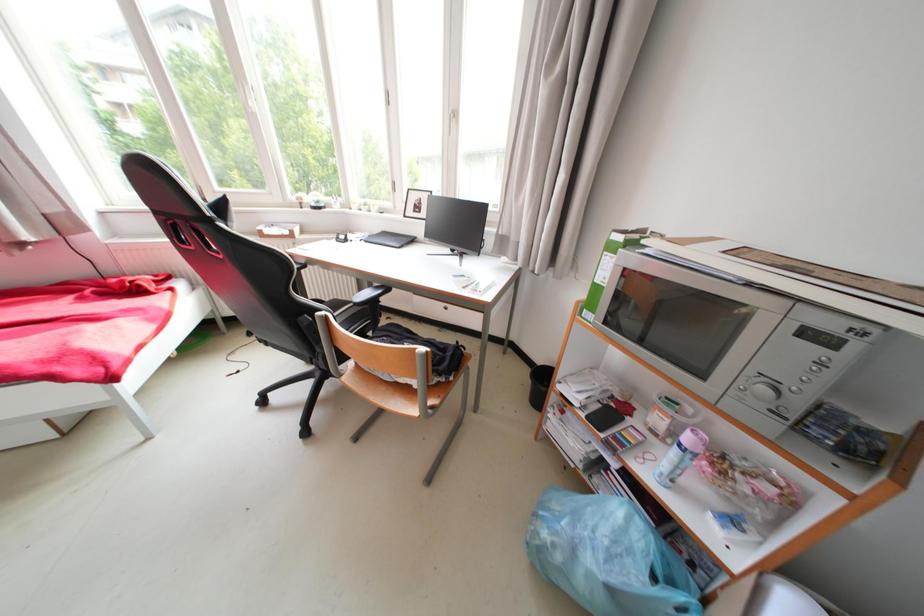
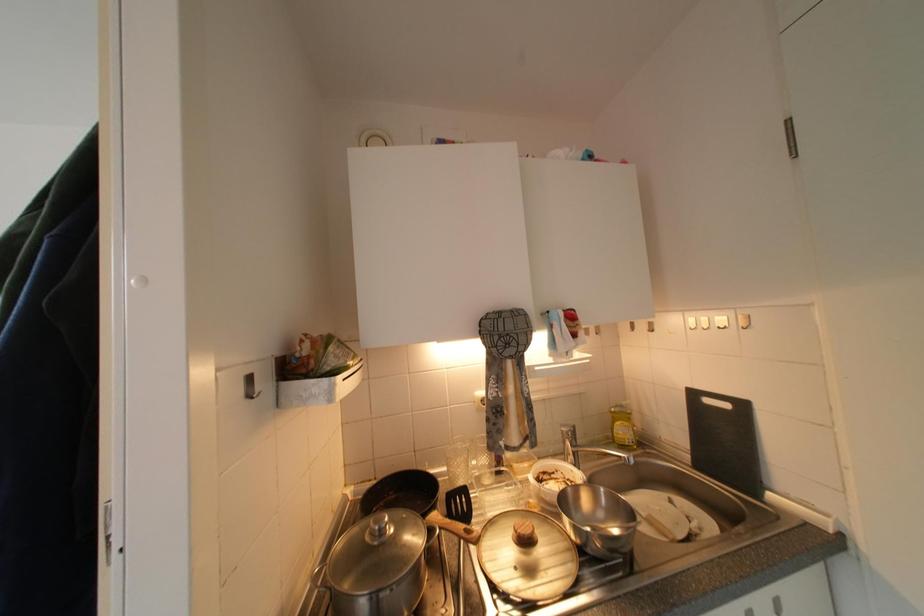
Question: How did the camera likely rotate?

Choices:
 (A) Left
 (B) Right
 (C) Up
 (D) Down

Answer: (B)